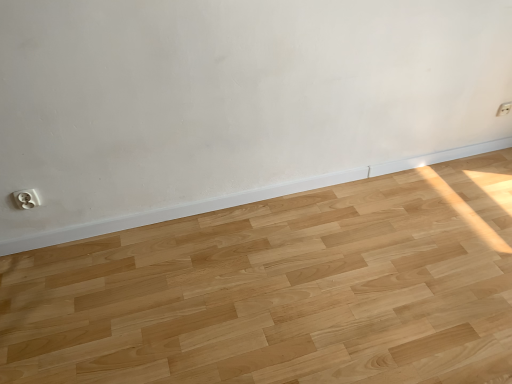
Question: From their relative heights in the image, would you say white plastic electric outlet at upper right, acting as the 2th electric outlet starting from the bottom, is taller or shorter than white plastic electric outlet at lower left, the 2th electric outlet when ordered from right to left?

Choices:
 (A) tall
 (B) short

Answer: (B)

Question: Visually, is white plastic electric outlet at upper right, placed as the 2th electric outlet when sorted from left to right, positioned to the left or to the right of white plastic electric outlet at lower left, which appears as the 1th electric outlet when viewed from the front?

Choices:
 (A) right
 (B) left

Answer: (A)

Question: Considering the positions of point (496, 115) and point (38, 203), is point (496, 115) closer or farther from the camera than point (38, 203)?

Choices:
 (A) farther
 (B) closer

Answer: (A)

Question: Is white plastic electric outlet at lower left, which appears as the 1th electric outlet when viewed from the front, taller or shorter than white plastic electric outlet at upper right, acting as the 2th electric outlet starting from the bottom?

Choices:
 (A) tall
 (B) short

Answer: (A)

Question: From the image's perspective, relative to white plastic electric outlet at upper right, arranged as the 2th electric outlet when viewed from the front, is white plastic electric outlet at lower left, the 2th electric outlet when ordered from right to left, above or below?

Choices:
 (A) below
 (B) above

Answer: (A)

Question: From a real-world perspective, is white plastic electric outlet at lower left, which is the 2th electric outlet from back to front, physically located above or below white plastic electric outlet at upper right, placed as the 2th electric outlet when sorted from left to right?

Choices:
 (A) above
 (B) below

Answer: (A)

Question: In terms of width, does white plastic electric outlet at lower left, acting as the 2th electric outlet starting from the top, look wider or thinner when compared to white plastic electric outlet at upper right, arranged as the 2th electric outlet when viewed from the front?

Choices:
 (A) thin
 (B) wide

Answer: (B)